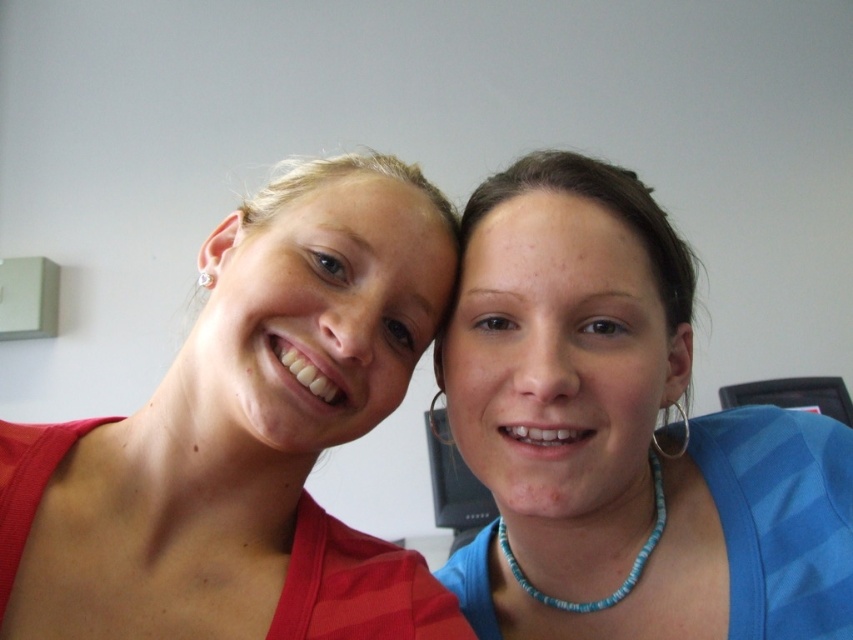
Which is more to the right, blue beaded necklace at upper right or blue beaded necklace at lower center?

From the viewer's perspective, blue beaded necklace at upper right appears more on the right side.

Who is taller, blue beaded necklace at upper right or blue beaded necklace at lower center?

With more height is blue beaded necklace at upper right.

I want to click on blue beaded necklace at upper right, so click(622, 435).

Which is more to the right, matte red shirt at left or blue beaded necklace at lower center?

Positioned to the right is blue beaded necklace at lower center.

Is matte red shirt at left in front of blue beaded necklace at lower center?

Yes.

Does point (190, 365) come in front of point (521, 582)?

Yes.

What are the coordinates of `matte red shirt at left` in the screenshot? It's located at (245, 436).

Who is more distant from viewer, (x=585, y=490) or (x=457, y=616)?

Point (x=457, y=616)

Does blue beaded necklace at upper right have a greater height compared to red striped dress at left?

Correct, blue beaded necklace at upper right is much taller as red striped dress at left.

Does point (656, 252) lie behind point (363, 554)?

No, (656, 252) is closer to viewer.

This screenshot has width=853, height=640. In order to click on blue beaded necklace at upper right in this screenshot , I will do `click(622, 435)`.